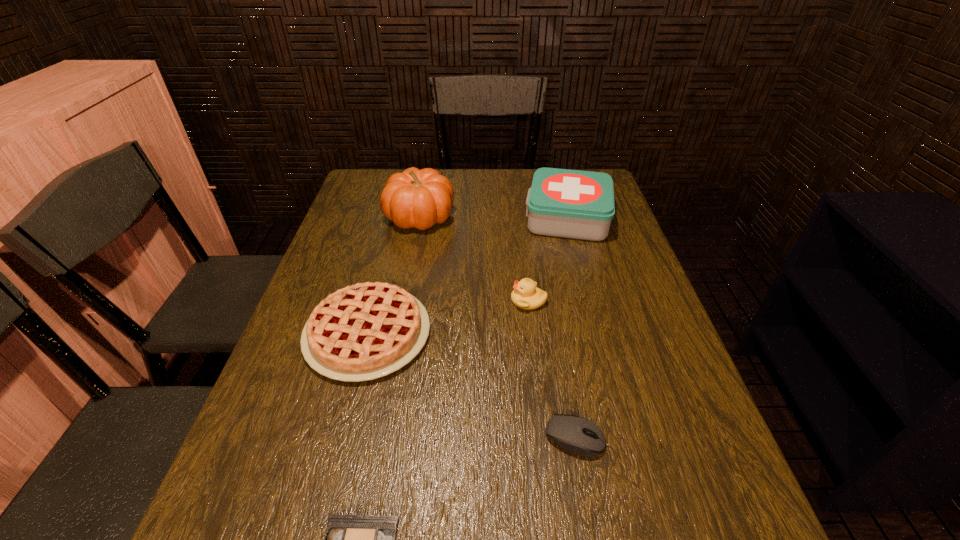
The width and height of the screenshot is (960, 540). Identify the location of free spot located 0.160m at the face of the fourth shortest object. (445, 301).

The height and width of the screenshot is (540, 960). In order to click on vacant space located on the right of the third shortest object in this screenshot , I will do `click(602, 334)`.

Identify the location of free space located on the front of the second shortest object. The image size is (960, 540). (585, 494).

Where is `pumpkin positioned at the far edge`? The height and width of the screenshot is (540, 960). pumpkin positioned at the far edge is located at coordinates (416, 198).

Where is `the first-aid kit positioned at the far edge`? the first-aid kit positioned at the far edge is located at coordinates (576, 204).

The image size is (960, 540). In order to click on pumpkin situated at the left edge in this screenshot , I will do `click(416, 198)`.

Where is `pie that is positioned at the left edge`? This screenshot has height=540, width=960. pie that is positioned at the left edge is located at coordinates (365, 331).

You are a GUI agent. You are given a task and a screenshot of the screen. Output one action in this format:
    pyautogui.click(x=<x>, y=<y>)
    Task: Click on the object that is positioned at the right edge
    
    Given the screenshot: What is the action you would take?
    pyautogui.click(x=576, y=204)

Locate an element on the screen. object situated at the far left corner is located at coordinates (416, 198).

Where is `object that is at the far right corner`? The width and height of the screenshot is (960, 540). object that is at the far right corner is located at coordinates (576, 204).